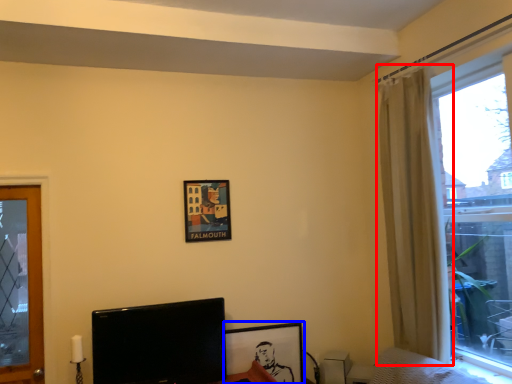
Question: Which object appears farthest to the camera in this image, curtain (highlighted by a red box) or picture frame (highlighted by a blue box)?

Choices:
 (A) curtain
 (B) picture frame

Answer: (B)